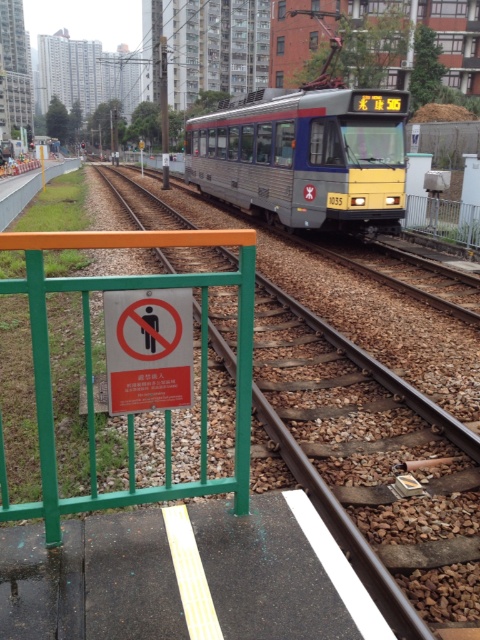
Question: Which point is farther from the camera taking this photo?

Choices:
 (A) click(276, 113)
 (B) click(324, 506)
 (C) click(418, 221)
 (D) click(180, 388)

Answer: (C)

Question: From the image, what is the correct spatial relationship of brown gravel train track at center in relation to red plastic sign at center?

Choices:
 (A) above
 (B) below

Answer: (A)

Question: Does metallic silver train at center have a greater width compared to green metal fence at right?

Choices:
 (A) yes
 (B) no

Answer: (A)

Question: Which point appears closest to the camera in this image?

Choices:
 (A) (105, 308)
 (B) (375, 531)
 (C) (437, 230)

Answer: (A)

Question: Is metallic silver train at center wider than red plastic sign at center?

Choices:
 (A) no
 (B) yes

Answer: (B)

Question: Which point appears farthest from the camera in this image?

Choices:
 (A) (320, 440)
 (B) (343, 172)
 (C) (464, 227)

Answer: (C)